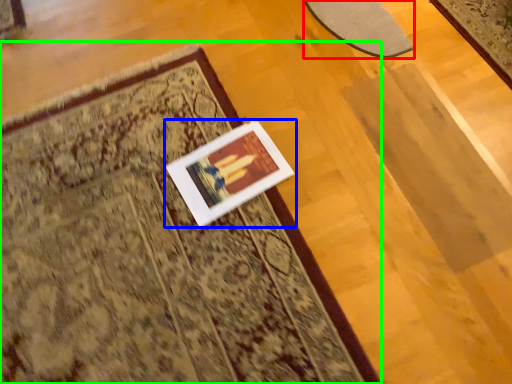
Question: Which is farther away from mat (highlighted by a red box)? picture frame (highlighted by a blue box) or mat (highlighted by a green box)?

Choices:
 (A) picture frame
 (B) mat

Answer: (B)